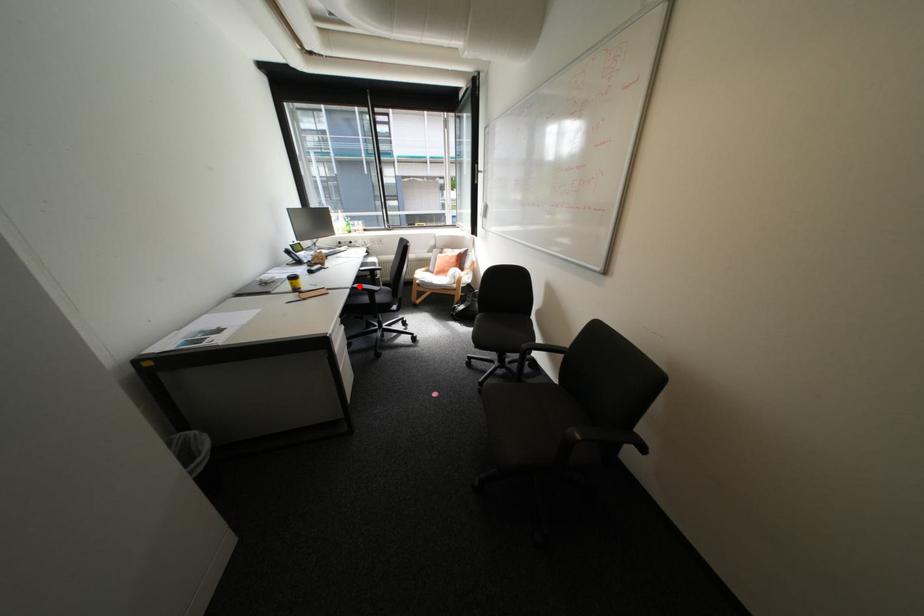
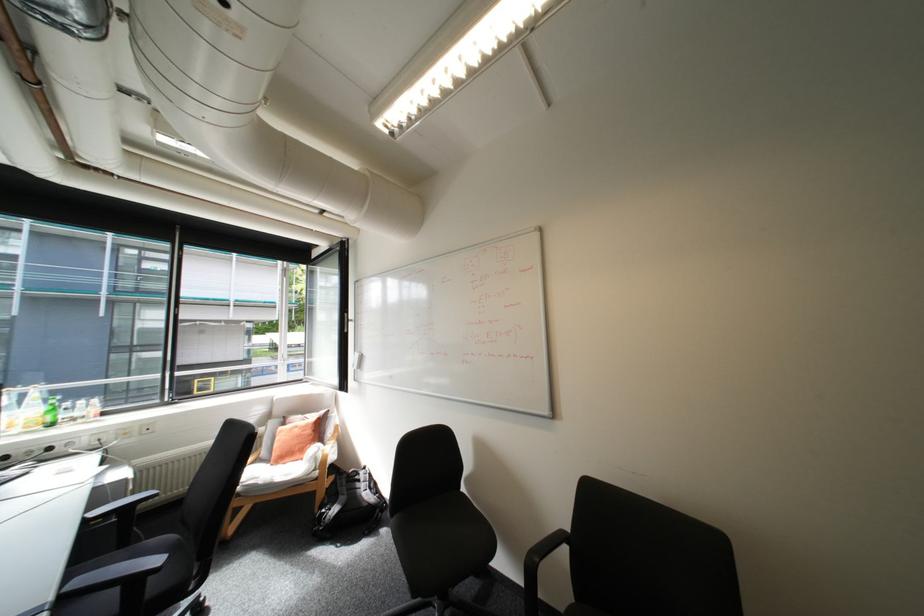
In the second image, find the point that corresponds to the highlighted location in the first image.

(61, 598)